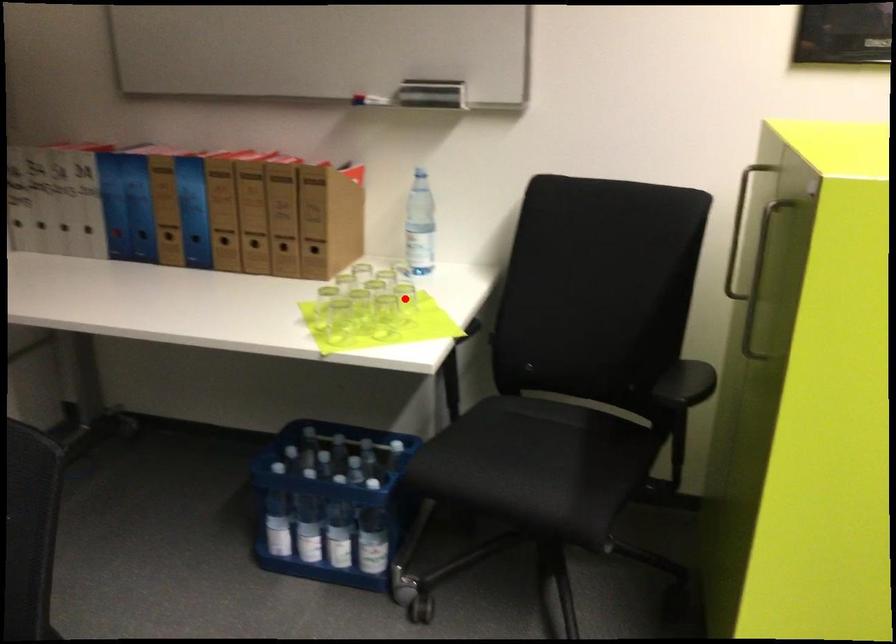
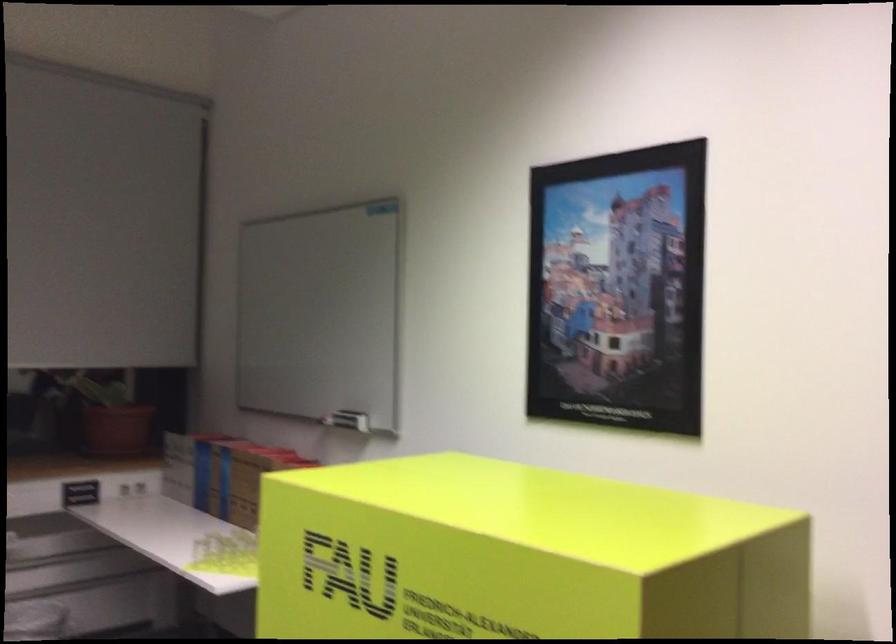
Question: I am providing you with two images of the same scene from different viewpoints. A red point is marked on the first image. At the location where the point appears in image 1, is it still visible in image 2?

Choices:
 (A) Yes
 (B) No

Answer: (B)